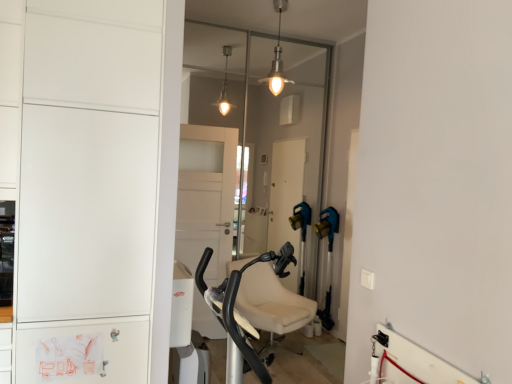
Question: From a real-world perspective, is transparent glass door at center beneath white matte cabinet at left?

Choices:
 (A) no
 (B) yes

Answer: (A)

Question: Is the depth of transparent glass door at center greater than that of white matte cabinet at left?

Choices:
 (A) yes
 (B) no

Answer: (A)

Question: From the image's perspective, is transparent glass door at center on white matte cabinet at left?

Choices:
 (A) no
 (B) yes

Answer: (B)

Question: Does transparent glass door at center have a greater width compared to white matte cabinet at left?

Choices:
 (A) yes
 (B) no

Answer: (B)

Question: From a real-world perspective, is transparent glass door at center on white matte cabinet at left?

Choices:
 (A) yes
 (B) no

Answer: (A)

Question: In the image, is metallic pendant light at upper center positioned in front of or behind white matte cabinet at left?

Choices:
 (A) behind
 (B) front

Answer: (A)

Question: Is metallic pendant light at upper center wider or thinner than white matte cabinet at left?

Choices:
 (A) thin
 (B) wide

Answer: (A)

Question: From a real-world perspective, is metallic pendant light at upper center above or below white matte cabinet at left?

Choices:
 (A) above
 (B) below

Answer: (A)

Question: Would you say metallic pendant light at upper center is inside or outside white matte cabinet at left?

Choices:
 (A) inside
 (B) outside

Answer: (B)

Question: Considering the positions of point (316, 66) and point (48, 145), is point (316, 66) closer or farther from the camera than point (48, 145)?

Choices:
 (A) closer
 (B) farther

Answer: (B)

Question: From a real-world perspective, relative to white matte cabinet at left, is transparent glass door at center vertically above or below?

Choices:
 (A) above
 (B) below

Answer: (A)

Question: Is transparent glass door at center wider or thinner than white matte cabinet at left?

Choices:
 (A) wide
 (B) thin

Answer: (B)

Question: Would you say transparent glass door at center is to the left or to the right of white matte cabinet at left in the picture?

Choices:
 (A) right
 (B) left

Answer: (A)

Question: From a real-world perspective, is white matte cabinet at left physically located above or below transparent glass door at center?

Choices:
 (A) below
 (B) above

Answer: (A)

Question: Is white matte cabinet at left taller or shorter than transparent glass door at center?

Choices:
 (A) tall
 (B) short

Answer: (A)